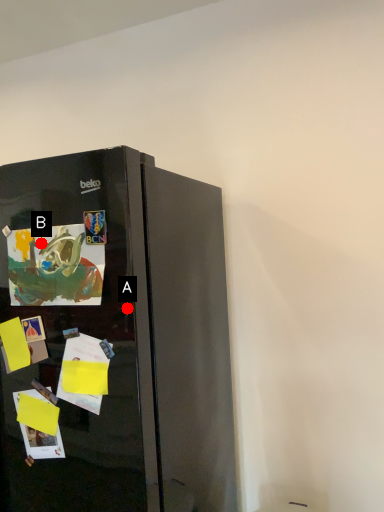
Question: Two points are circled on the image, labeled by A and B beside each circle. Which point is closer to the camera?

Choices:
 (A) A is closer
 (B) B is closer

Answer: (A)